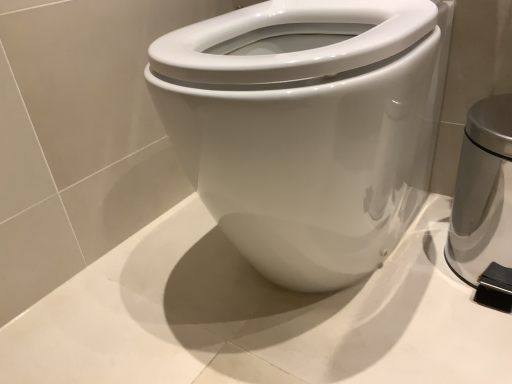
Question: Does point (462, 216) appear closer or farther from the camera than point (382, 59)?

Choices:
 (A) farther
 (B) closer

Answer: (A)

Question: In terms of height, does satin silver trash can at right look taller or shorter compared to white glossy bidet at center?

Choices:
 (A) short
 (B) tall

Answer: (A)

Question: From a real-world perspective, relative to white glossy bidet at center, is satin silver trash can at right vertically above or below?

Choices:
 (A) below
 (B) above

Answer: (A)

Question: Considering their positions, is white glossy bidet at center located in front of or behind satin silver trash can at right?

Choices:
 (A) front
 (B) behind

Answer: (A)

Question: From the image's perspective, is white glossy bidet at center located above or below satin silver trash can at right?

Choices:
 (A) below
 (B) above

Answer: (B)

Question: In terms of height, does white glossy bidet at center look taller or shorter compared to satin silver trash can at right?

Choices:
 (A) short
 (B) tall

Answer: (B)

Question: In the image, is white glossy bidet at center on the left side or the right side of satin silver trash can at right?

Choices:
 (A) left
 (B) right

Answer: (A)